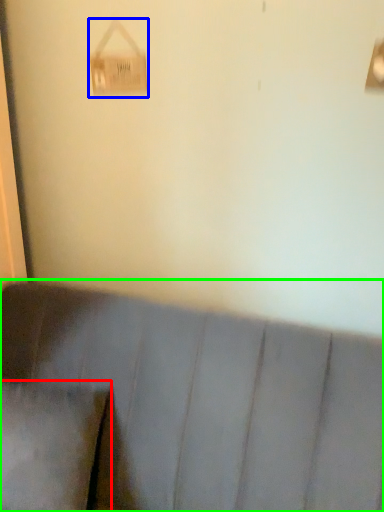
Question: Which object is positioned closest to pillow (highlighted by a red box)? Select from lamp (highlighted by a blue box) and furniture (highlighted by a green box).

Choices:
 (A) lamp
 (B) furniture

Answer: (B)